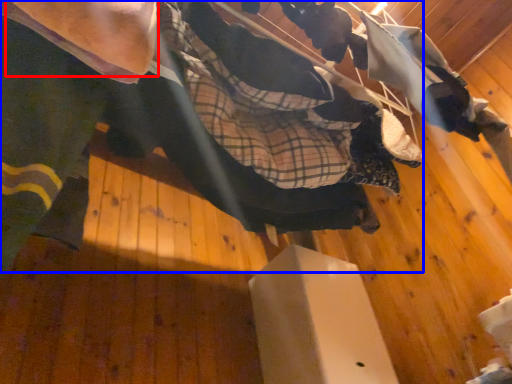
Question: Which point is further to the camera, arm (highlighted by a red box) or skateboarder (highlighted by a blue box)?

Choices:
 (A) arm
 (B) skateboarder

Answer: (B)